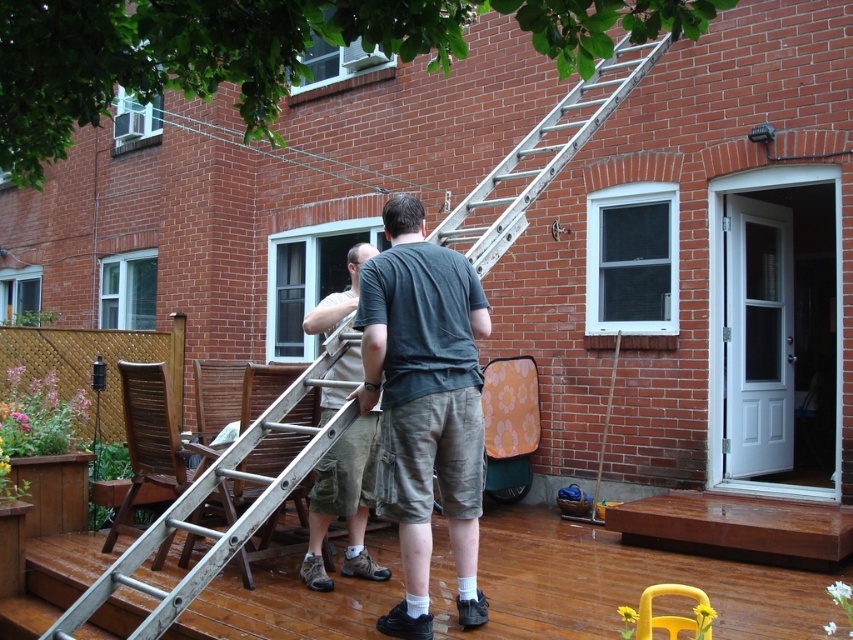
Question: Is wooden at lower left to the left of silver metallic ladder at center from the viewer's perspective?

Choices:
 (A) yes
 (B) no

Answer: (B)

Question: Which point appears closest to the camera in this image?

Choices:
 (A) (395, 508)
 (B) (45, 564)
 (C) (190, 525)

Answer: (C)

Question: Is silver metallic ladder at center to the left of khaki cotton shorts at center from the viewer's perspective?

Choices:
 (A) no
 (B) yes

Answer: (A)

Question: Estimate the real-world distances between objects in this image. Which object is closer to the wooden at lower left?

Choices:
 (A) silver metallic ladder at center
 (B) dark gray t-shirt at center
 (C) khaki cotton shorts at center

Answer: (B)

Question: Can you confirm if wooden at lower left is positioned above silver metallic ladder at center?

Choices:
 (A) no
 (B) yes

Answer: (A)

Question: Which of the following is the farthest from the observer?

Choices:
 (A) (114, 624)
 (B) (375, 426)

Answer: (B)